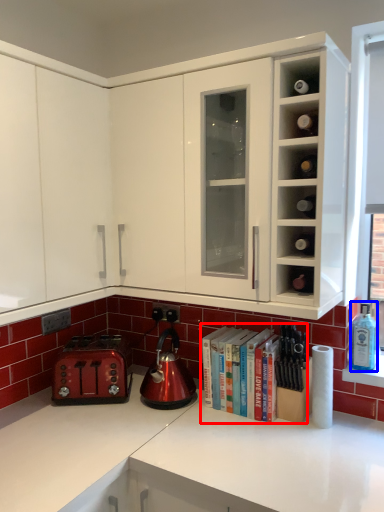
Question: Which object appears closest to the camera in this image, book (highlighted by a red box) or bottle (highlighted by a blue box)?

Choices:
 (A) book
 (B) bottle

Answer: (A)